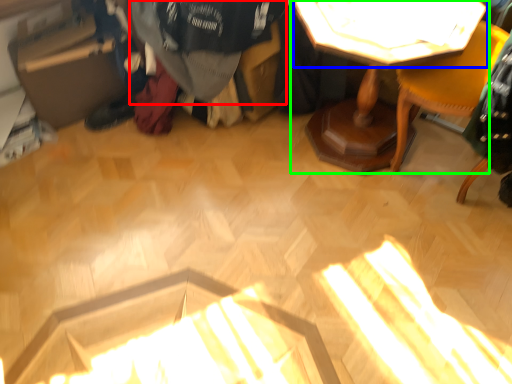
Question: Considering the real-world distances, which object is closest to clothing (highlighted by a red box)? table top (highlighted by a blue box) or table (highlighted by a green box).

Choices:
 (A) table top
 (B) table

Answer: (B)